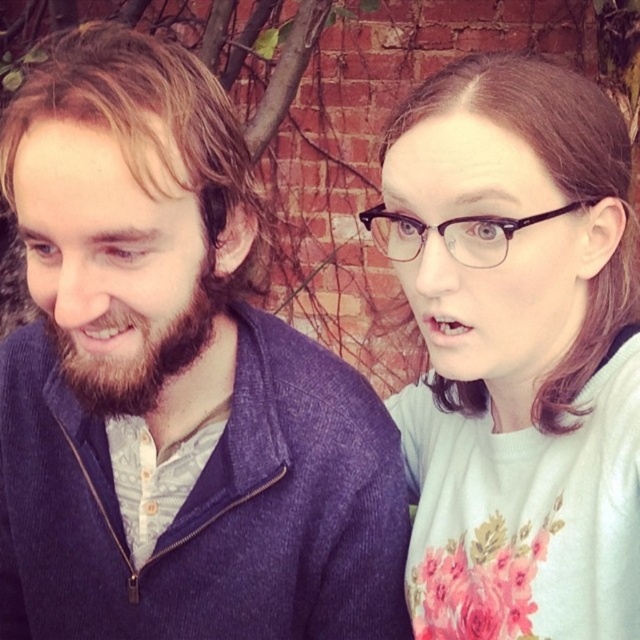
In the scene shown: You are a photographer adjusting your camera settings to capture the scene. You notice the dark brown fuzzy beard at left and the black plastic glasses at upper right. Which object has a smaller width in the image?

The dark brown fuzzy beard at left is thinner than the black plastic glasses at upper right, so it has a smaller width in the image.

You are a photographer trying to capture a candid shot of the man and woman in the scene. You notice a specific point at coordinates point (x=138, y=353). What object in the scene is located at this point?

The dark brown fuzzy beard at left is located at point (x=138, y=353).

You are an artist trying to sketch the scene. You need to decide which object to draw first based on their sizes. Which one should you start with, the matte blue sweater at left or the black plastic glasses at upper right?

The matte blue sweater at left is wider than the black plastic glasses at upper right, so you should start with the wider matte blue sweater at left to ensure proper proportions in your sketch.